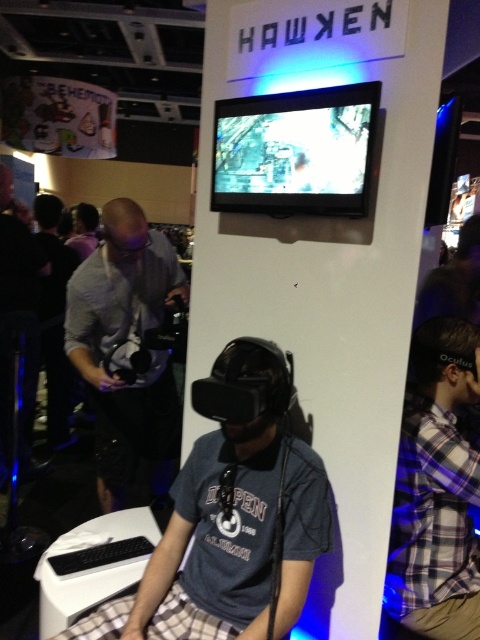
You are a photographer at the expo and need to capture a photo of the matte gray vr headset at center and the gray fabric shirt at left. From the perspective of someone standing in front of the scene, which object is positioned to the right?

The matte gray vr headset at center is positioned to the right of the gray fabric shirt at left.

You are a photographer at the expo and want to capture a photo of the matte gray vr headset at center and the plaid fabric shirt at right. Since you can only focus on one object, which one should you choose to ensure the other appears blurry?

You should focus on the matte gray vr headset at center because it is closer to the viewer than the plaid fabric shirt at right, so if you focus on it, the plaid fabric shirt at right will appear blurry due to the depth of field.